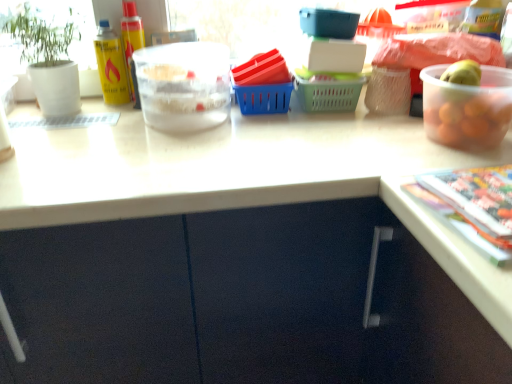
The width and height of the screenshot is (512, 384). I want to click on multicolored glossy magazine at lower right, so click(x=472, y=206).

Describe the element at coordinates (183, 85) in the screenshot. I see `translucent plastic bowl at upper center, marked as the first bowl in a back-to-front arrangement` at that location.

You are a GUI agent. You are given a task and a screenshot of the screen. Output one action in this format:
    pyautogui.click(x=<x>, y=<y>)
    Task: Click on the green matte plant pot at left
    This screenshot has height=384, width=512.
    Given the screenshot: What is the action you would take?
    pyautogui.click(x=48, y=62)

Which of these two, transparent plastic bowl at upper right, placed as the first bowl when sorted from right to left, or multicolored glossy magazine at lower right, stands shorter?

With less height is multicolored glossy magazine at lower right.

Is transparent plastic bowl at upper right, placed as the first bowl when sorted from right to left, positioned in front of multicolored glossy magazine at lower right?

No, the depth of transparent plastic bowl at upper right, placed as the first bowl when sorted from right to left, is greater than that of multicolored glossy magazine at lower right.

Is transparent plastic bowl at upper right, the 1th bowl viewed from the front, far away from multicolored glossy magazine at lower right?

Actually, transparent plastic bowl at upper right, the 1th bowl viewed from the front, and multicolored glossy magazine at lower right are a little close together.

Is transparent plastic bowl at upper right, which is the second bowl in back-to-front order, looking in the opposite direction of multicolored glossy magazine at lower right?

No, multicolored glossy magazine at lower right is not at the back of transparent plastic bowl at upper right, which is the second bowl in back-to-front order.

Is green matte plant pot at left wider or thinner than translucent plastic bowl at upper center, acting as the 1th bowl starting from the left?

Considering their sizes, green matte plant pot at left looks slimmer than translucent plastic bowl at upper center, acting as the 1th bowl starting from the left.

From the image's perspective, would you say green matte plant pot at left is shown under translucent plastic bowl at upper center, positioned as the 2th bowl in front-to-back order?

No, from the image's perspective, green matte plant pot at left is not below translucent plastic bowl at upper center, positioned as the 2th bowl in front-to-back order.

Can you confirm if green matte plant pot at left is bigger than translucent plastic bowl at upper center, marked as the second bowl in a right-to-left arrangement?

Correct, green matte plant pot at left is larger in size than translucent plastic bowl at upper center, marked as the second bowl in a right-to-left arrangement.

In the image, is green matte plant pot at left positioned in front of or behind translucent plastic bowl at upper center, marked as the first bowl in a back-to-front arrangement?

In the image, green matte plant pot at left appears behind translucent plastic bowl at upper center, marked as the first bowl in a back-to-front arrangement.

Which of these two, multicolored glossy magazine at lower right or transparent plastic bowl at upper right, placed as the 2th bowl when sorted from left to right, is smaller?

With smaller size is multicolored glossy magazine at lower right.

I want to click on magazine on the right of transparent plastic bowl at upper right, placed as the 2th bowl when sorted from left to right, so click(x=472, y=206).

Does multicolored glossy magazine at lower right have a greater height compared to transparent plastic bowl at upper right, the 1th bowl viewed from the front?

No.

Is the position of multicolored glossy magazine at lower right less distant than that of transparent plastic bowl at upper right, placed as the first bowl when sorted from right to left?

Yes, multicolored glossy magazine at lower right is closer to the viewer.

Based on the photo, is translucent plastic bowl at upper center, positioned as the 2th bowl in front-to-back order, in front of transparent plastic bowl at upper right, the 1th bowl viewed from the front?

No.

Which object is positioned more to the right, translucent plastic bowl at upper center, acting as the 1th bowl starting from the left, or transparent plastic bowl at upper right, the 1th bowl viewed from the front?

Positioned to the right is transparent plastic bowl at upper right, the 1th bowl viewed from the front.

Is translucent plastic bowl at upper center, positioned as the 2th bowl in front-to-back order, completely or partially outside of transparent plastic bowl at upper right, placed as the 2th bowl when sorted from left to right?

Yes, translucent plastic bowl at upper center, positioned as the 2th bowl in front-to-back order, is located beyond the bounds of transparent plastic bowl at upper right, placed as the 2th bowl when sorted from left to right.

Is translucent plastic bowl at upper center, marked as the second bowl in a right-to-left arrangement, not inside green matte plant pot at left?

Indeed, translucent plastic bowl at upper center, marked as the second bowl in a right-to-left arrangement, is completely outside green matte plant pot at left.

From the picture: Is translucent plastic bowl at upper center, marked as the second bowl in a right-to-left arrangement, facing away from green matte plant pot at left?

No, green matte plant pot at left is not at the back of translucent plastic bowl at upper center, marked as the second bowl in a right-to-left arrangement.

From the picture: Is translucent plastic bowl at upper center, acting as the 1th bowl starting from the left, taller than green matte plant pot at left?

Incorrect, the height of translucent plastic bowl at upper center, acting as the 1th bowl starting from the left, is not larger of that of green matte plant pot at left.

Does point (147, 61) appear closer or farther from the camera than point (36, 71)?

Point (147, 61).

Is transparent plastic bowl at upper right, the 1th bowl viewed from the front, facing towards green matte plant pot at left?

No, transparent plastic bowl at upper right, the 1th bowl viewed from the front, is not facing towards green matte plant pot at left.

From a real-world perspective, which object stands above the other?

In real-world perspective, green matte plant pot at left is above.

Considering the relative sizes of translucent plastic bowl at upper center, marked as the first bowl in a back-to-front arrangement, and multicolored glossy magazine at lower right in the image provided, is translucent plastic bowl at upper center, marked as the first bowl in a back-to-front arrangement, shorter than multicolored glossy magazine at lower right?

Incorrect, the height of translucent plastic bowl at upper center, marked as the first bowl in a back-to-front arrangement, does not fall short of that of multicolored glossy magazine at lower right.

Is translucent plastic bowl at upper center, positioned as the 2th bowl in front-to-back order, beside multicolored glossy magazine at lower right?

No, translucent plastic bowl at upper center, positioned as the 2th bowl in front-to-back order, is not touching multicolored glossy magazine at lower right.

Does translucent plastic bowl at upper center, positioned as the 2th bowl in front-to-back order, appear on the left side of multicolored glossy magazine at lower right?

Yes, translucent plastic bowl at upper center, positioned as the 2th bowl in front-to-back order, is to the left of multicolored glossy magazine at lower right.

Is translucent plastic bowl at upper center, positioned as the 2th bowl in front-to-back order, oriented towards multicolored glossy magazine at lower right?

No, translucent plastic bowl at upper center, positioned as the 2th bowl in front-to-back order, does not turn towards multicolored glossy magazine at lower right.

Locate an element on the screen. magazine beneath the transparent plastic bowl at upper right, placed as the 2th bowl when sorted from left to right (from a real-world perspective) is located at coordinates (472, 206).

Image resolution: width=512 pixels, height=384 pixels. Identify the location of houseplant lying above the translucent plastic bowl at upper center, positioned as the 2th bowl in front-to-back order (from the image's perspective). click(48, 62).

Considering their positions, is translucent plastic bowl at upper center, positioned as the 2th bowl in front-to-back order, positioned closer to transparent plastic bowl at upper right, placed as the 2th bowl when sorted from left to right, than green matte plant pot at left?

Based on the image, translucent plastic bowl at upper center, positioned as the 2th bowl in front-to-back order, appears to be nearer to transparent plastic bowl at upper right, placed as the 2th bowl when sorted from left to right.

Considering their positions, is translucent plastic bowl at upper center, positioned as the 2th bowl in front-to-back order, positioned closer to green matte plant pot at left than multicolored glossy magazine at lower right?

The object closer to green matte plant pot at left is translucent plastic bowl at upper center, positioned as the 2th bowl in front-to-back order.

Consider the image. Based on their spatial positions, is transparent plastic bowl at upper right, placed as the first bowl when sorted from right to left, or green matte plant pot at left further from multicolored glossy magazine at lower right?

The object further to multicolored glossy magazine at lower right is green matte plant pot at left.

Estimate the real-world distances between objects in this image. Which object is further from translucent plastic bowl at upper center, marked as the second bowl in a right-to-left arrangement, transparent plastic bowl at upper right, placed as the first bowl when sorted from right to left, or multicolored glossy magazine at lower right?

Based on the image, multicolored glossy magazine at lower right appears to be further to translucent plastic bowl at upper center, marked as the second bowl in a right-to-left arrangement.

Considering their positions, is transparent plastic bowl at upper right, placed as the 2th bowl when sorted from left to right, positioned further to translucent plastic bowl at upper center, acting as the 1th bowl starting from the left, than green matte plant pot at left?

Among the two, transparent plastic bowl at upper right, placed as the 2th bowl when sorted from left to right, is located further to translucent plastic bowl at upper center, acting as the 1th bowl starting from the left.

When comparing their distances from green matte plant pot at left, does multicolored glossy magazine at lower right or translucent plastic bowl at upper center, marked as the second bowl in a right-to-left arrangement, seem further?

multicolored glossy magazine at lower right lies further to green matte plant pot at left than the other object.

From the image, which object appears to be farther from green matte plant pot at left, transparent plastic bowl at upper right, placed as the 2th bowl when sorted from left to right, or multicolored glossy magazine at lower right?

The object further to green matte plant pot at left is multicolored glossy magazine at lower right.

Based on the photo, looking at the image, which one is located closer to green matte plant pot at left, transparent plastic bowl at upper right, the 1th bowl viewed from the front, or translucent plastic bowl at upper center, acting as the 1th bowl starting from the left?

The object closer to green matte plant pot at left is translucent plastic bowl at upper center, acting as the 1th bowl starting from the left.

Locate an element on the screen. This screenshot has height=384, width=512. bowl between green matte plant pot at left and transparent plastic bowl at upper right, which is the second bowl in back-to-front order, in the horizontal direction is located at coordinates (183, 85).

The image size is (512, 384). I want to click on bowl located between translucent plastic bowl at upper center, marked as the first bowl in a back-to-front arrangement, and multicolored glossy magazine at lower right in the left-right direction, so click(x=467, y=108).